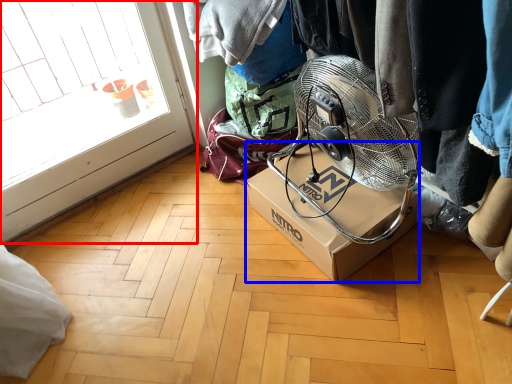
Question: Which point is closer to the camera, glass door (highlighted by a red box) or box (highlighted by a blue box)?

Choices:
 (A) glass door
 (B) box

Answer: (A)